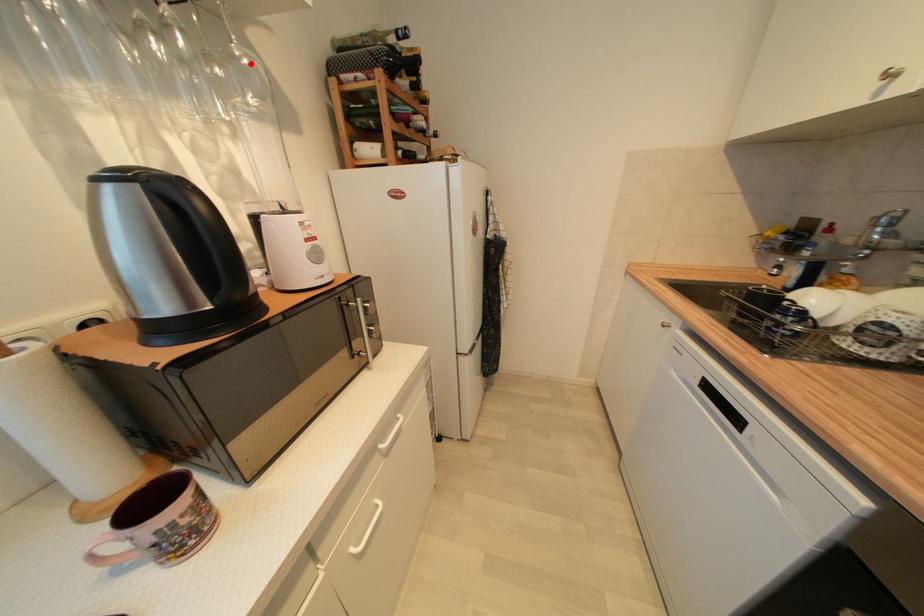
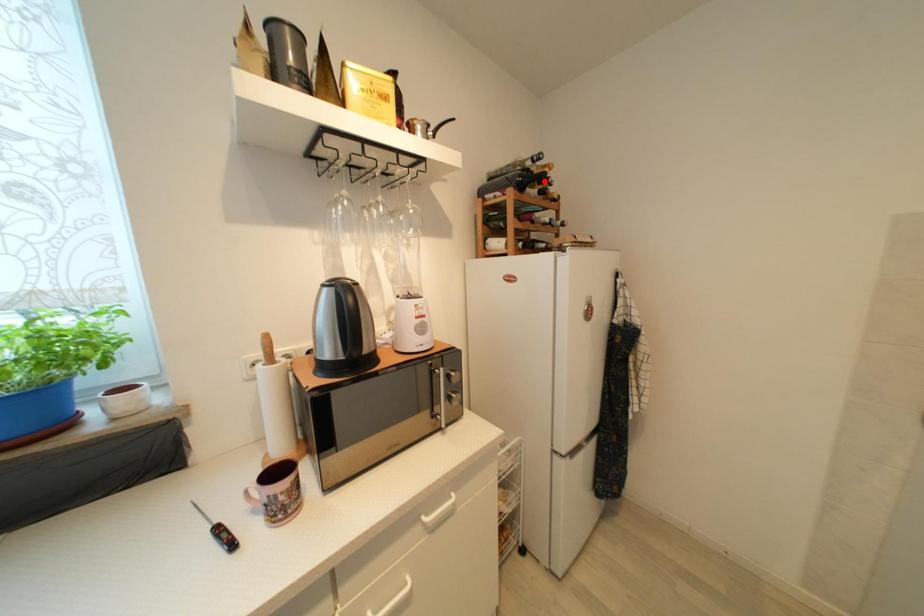
I am providing you with two images of the same scene from different viewpoints. A red point is marked on the first image and another point is marked on the second image. Do the highlighted points in image1 and image2 indicate the same real-world spot?

No